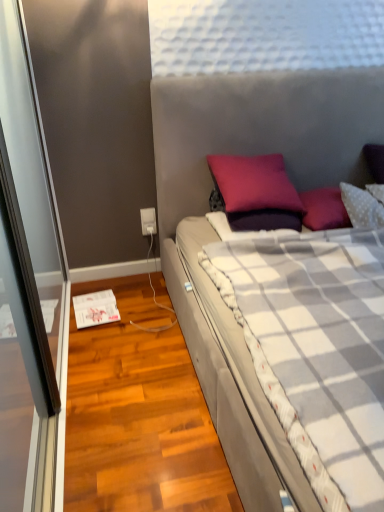
Question: Is white plastic power outlet at lower left wider than plush gray bed at center?

Choices:
 (A) yes
 (B) no

Answer: (B)

Question: Does white plastic power outlet at lower left have a greater height compared to plush gray bed at center?

Choices:
 (A) yes
 (B) no

Answer: (B)

Question: Does white plastic power outlet at lower left appear on the left side of plush gray bed at center?

Choices:
 (A) yes
 (B) no

Answer: (A)

Question: Considering the relative sizes of white plastic power outlet at lower left and plush gray bed at center in the image provided, is white plastic power outlet at lower left smaller than plush gray bed at center?

Choices:
 (A) no
 (B) yes

Answer: (B)

Question: From a real-world perspective, is white plastic power outlet at lower left under plush gray bed at center?

Choices:
 (A) yes
 (B) no

Answer: (A)

Question: Looking at their shapes, would you say purple matte pillow at center is wider or thinner than plush gray bed at center?

Choices:
 (A) wide
 (B) thin

Answer: (B)

Question: In the image, is purple matte pillow at center on the left side or the right side of plush gray bed at center?

Choices:
 (A) left
 (B) right

Answer: (A)

Question: From a real-world perspective, relative to plush gray bed at center, is purple matte pillow at center vertically above or below?

Choices:
 (A) below
 (B) above

Answer: (B)

Question: From the image's perspective, is purple matte pillow at center above or below plush gray bed at center?

Choices:
 (A) below
 (B) above

Answer: (B)

Question: Relative to white plastic power outlet at lower left, is plush gray bed at center in front or behind?

Choices:
 (A) behind
 (B) front

Answer: (B)

Question: From a real-world perspective, is plush gray bed at center positioned above or below white plastic power outlet at lower left?

Choices:
 (A) below
 (B) above

Answer: (B)

Question: Based on their sizes in the image, would you say plush gray bed at center is bigger or smaller than white plastic power outlet at lower left?

Choices:
 (A) big
 (B) small

Answer: (A)

Question: Is plush gray bed at center spatially inside white plastic power outlet at lower left, or outside of it?

Choices:
 (A) inside
 (B) outside

Answer: (B)

Question: Relative to purple matte pillow at center, is white plastic power outlet at lower left in front or behind?

Choices:
 (A) behind
 (B) front

Answer: (A)

Question: Is point (140, 208) positioned closer to the camera than point (243, 179)?

Choices:
 (A) closer
 (B) farther

Answer: (B)